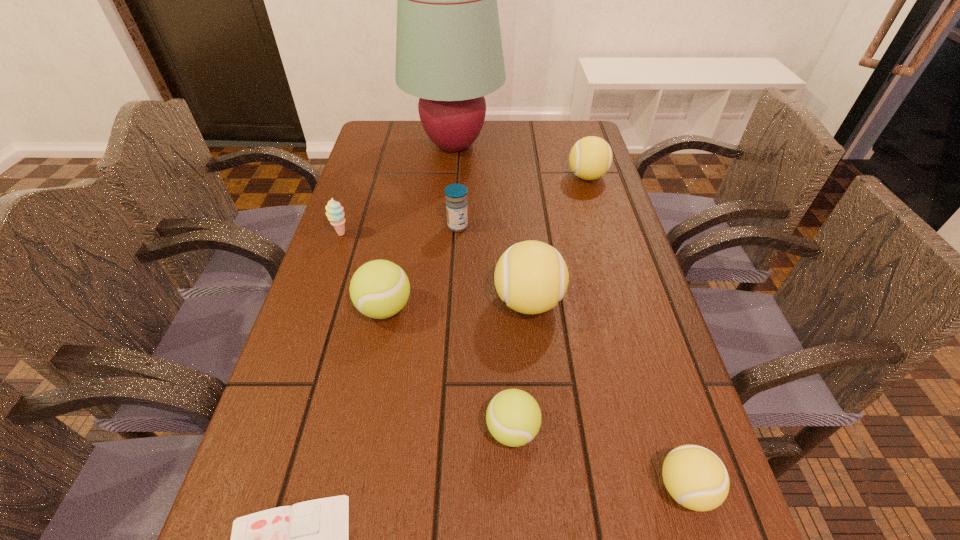
The image size is (960, 540). I want to click on the nearest yellow tennis ball, so click(695, 477).

Identify the location of the smallest yellow tennis ball. This screenshot has height=540, width=960. (695, 477).

Locate an element on the screen. the third nearest object is located at coordinates (513, 417).

Locate an element on the screen. Image resolution: width=960 pixels, height=540 pixels. the right green tennis ball is located at coordinates (513, 417).

Locate an element on the screen. The height and width of the screenshot is (540, 960). free space located on the front of the lampshade is located at coordinates (447, 227).

Find the location of `vacant space located on the back of the second tallest object`. vacant space located on the back of the second tallest object is located at coordinates click(x=520, y=224).

At what (x,y) coordinates should I click in order to perform the action: click on free space located 0.090m on the front of the farther green tennis ball. Please return your answer as a coordinate pair (x, y). The height and width of the screenshot is (540, 960). Looking at the image, I should click on (x=372, y=369).

Where is `vacant space located 0.340m on the left of the second biggest yellow tennis ball`? The height and width of the screenshot is (540, 960). vacant space located 0.340m on the left of the second biggest yellow tennis ball is located at coordinates click(449, 177).

The width and height of the screenshot is (960, 540). I want to click on blank space located on the front of the sherbert, so click(318, 304).

Image resolution: width=960 pixels, height=540 pixels. Identify the location of vacant space situated on the right of the medicine. (543, 226).